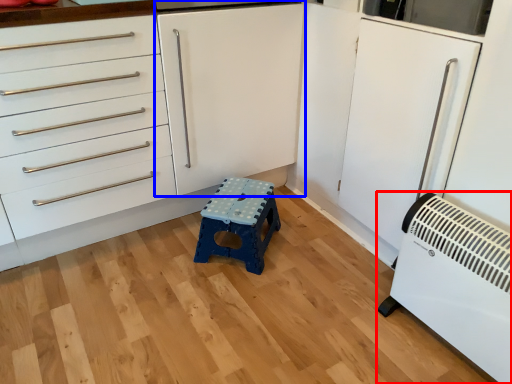
Question: Which object is closer to the camera taking this photo, home appliance (highlighted by a red box) or cabinetry (highlighted by a blue box)?

Choices:
 (A) home appliance
 (B) cabinetry

Answer: (A)